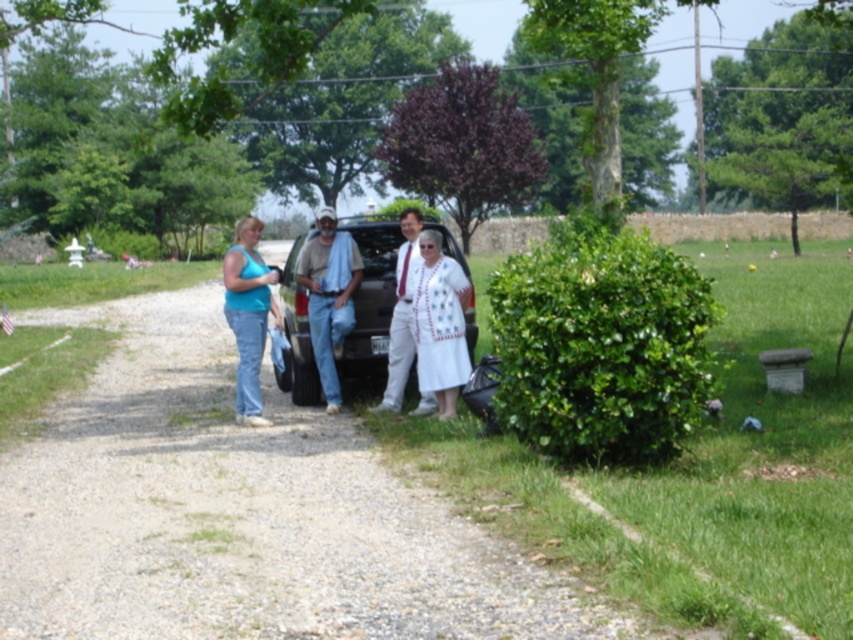
Is the position of denim jeans at center more distant than that of white cotton shirt at center?

Yes, denim jeans at center is further from the viewer.

Who is positioned more to the left, denim jeans at center or white cotton shirt at center?

Positioned to the left is denim jeans at center.

Does point (311, 273) come farther from viewer compared to point (398, 362)?

Yes, point (311, 273) is behind point (398, 362).

Locate an element on the screen. Image resolution: width=853 pixels, height=640 pixels. denim jeans at center is located at coordinates (329, 296).

Which is behind, point (256, 291) or point (403, 260)?

The point (403, 260) is behind.

Who is shorter, matte blue tank top at center or white cotton shirt at center?

Standing shorter between the two is matte blue tank top at center.

In order to click on matte blue tank top at center in this screenshot , I will do `click(248, 314)`.

Identify the location of matte blue tank top at center. This screenshot has width=853, height=640. (248, 314).

Does gravel path at center have a lesser width compared to matte blue tank top at center?

No, gravel path at center is not thinner than matte blue tank top at center.

Is gravel path at center shorter than matte blue tank top at center?

Correct, gravel path at center is not as tall as matte blue tank top at center.

Find the location of a particular element. gravel path at center is located at coordinates (241, 513).